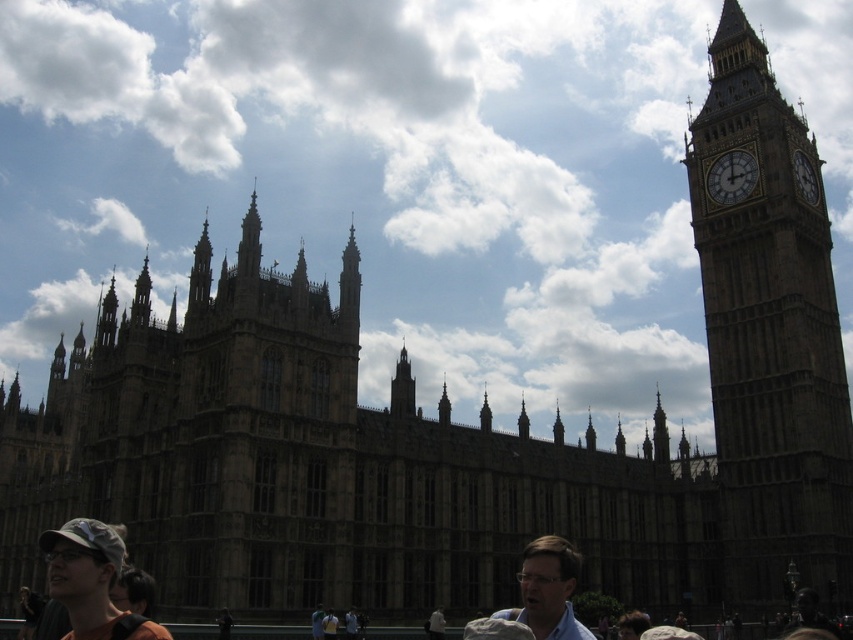
Who is lower down, blue fabric shirt at lower center or white stone clock at upper right?

Positioned lower is blue fabric shirt at lower center.

Locate an element on the screen. blue fabric shirt at lower center is located at coordinates (547, 589).

I want to click on blue fabric shirt at lower center, so click(547, 589).

Is point (770, 211) closer to viewer compared to point (711, 170)?

Yes.

Which is below, brown stone clock tower at right or white stone clock at upper right?

brown stone clock tower at right

Describe the element at coordinates (770, 337) in the screenshot. The height and width of the screenshot is (640, 853). I see `brown stone clock tower at right` at that location.

Where is `brown stone clock tower at right`? This screenshot has width=853, height=640. brown stone clock tower at right is located at coordinates (770, 337).

Can you confirm if brown leather jacket at lower center is bigger than blue fabric shirt at lower center?

Correct, brown leather jacket at lower center is larger in size than blue fabric shirt at lower center.

Between brown leather jacket at lower center and blue fabric shirt at lower center, which one has less height?

blue fabric shirt at lower center is shorter.

Does point (80, 624) come farther from viewer compared to point (567, 577)?

No, it is not.

Locate an element on the screen. The width and height of the screenshot is (853, 640). brown leather jacket at lower center is located at coordinates (94, 586).